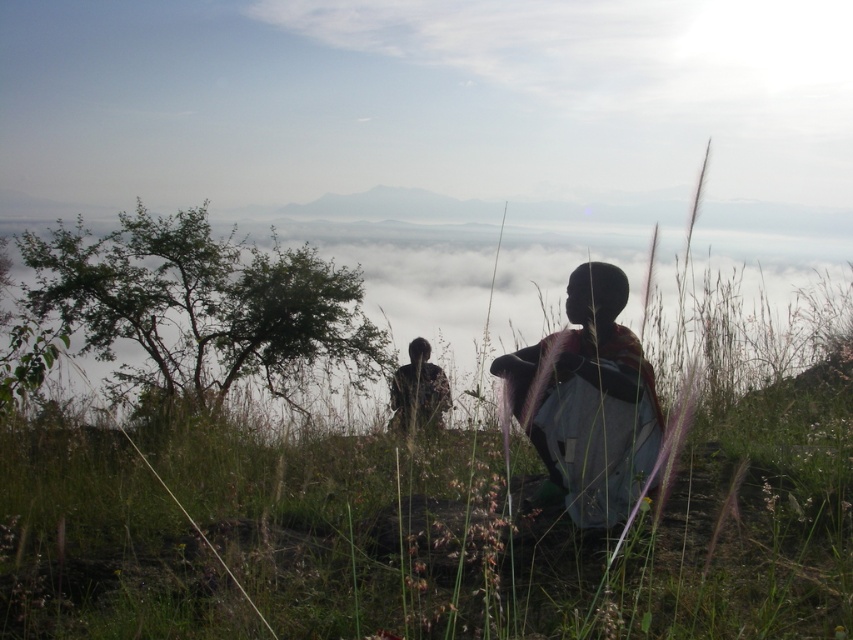
Which is below, silhouette fabric at center or dark brown leather jacket at center?

dark brown leather jacket at center is lower down.

Does silhouette fabric at center have a greater width compared to dark brown leather jacket at center?

Yes.

The height and width of the screenshot is (640, 853). Describe the element at coordinates (589, 401) in the screenshot. I see `silhouette fabric at center` at that location.

You are a GUI agent. You are given a task and a screenshot of the screen. Output one action in this format:
    pyautogui.click(x=<x>, y=<y>)
    Task: Click on the silhouette fabric at center
    The width and height of the screenshot is (853, 640).
    Given the screenshot: What is the action you would take?
    pyautogui.click(x=589, y=401)